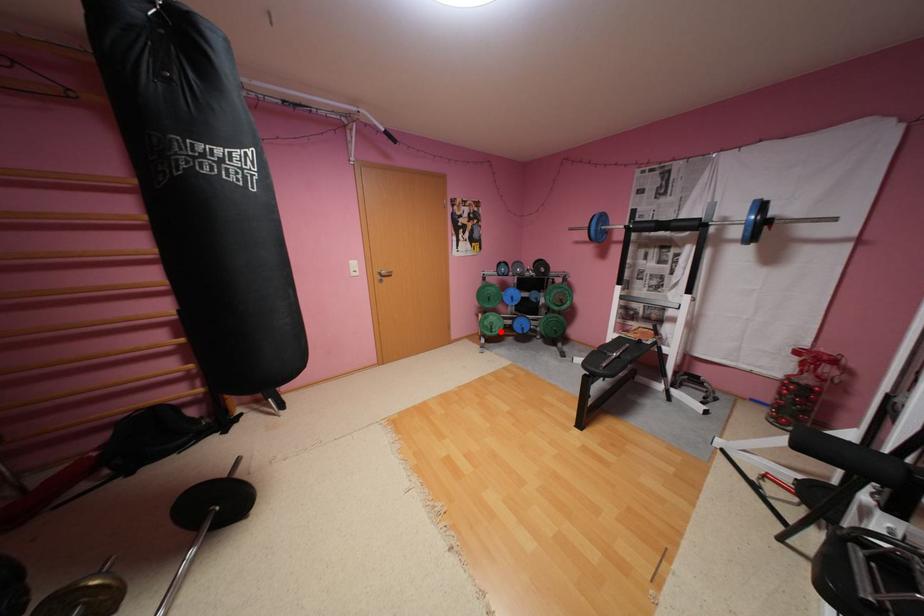
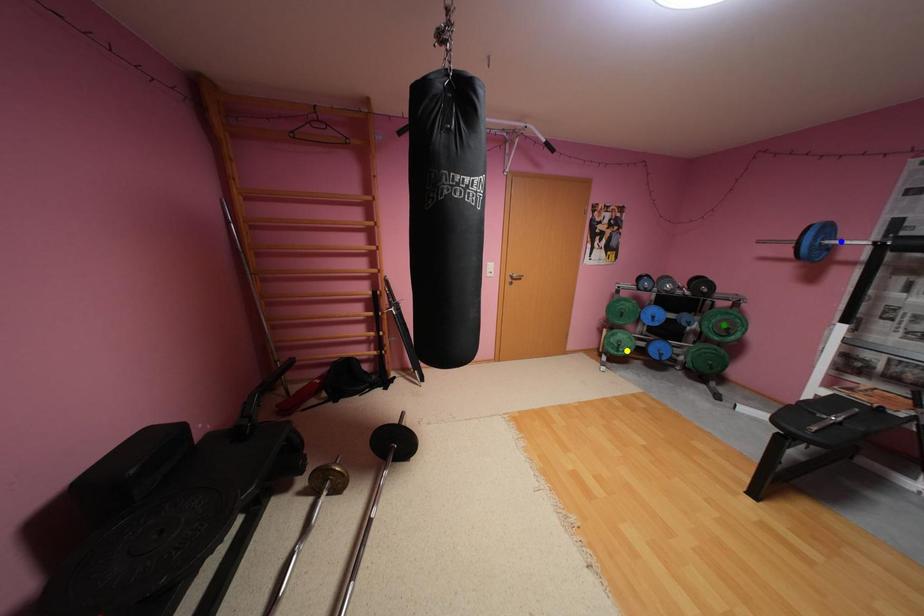
Question: I am providing you with two images of the same scene from different viewpoints. A red point is marked on the first image. You are given multiple points on the second image. In image 2, which mark is for the same physical point as the one in image 1?

Choices:
 (A) yellow point
 (B) green point
 (C) blue point

Answer: (A)